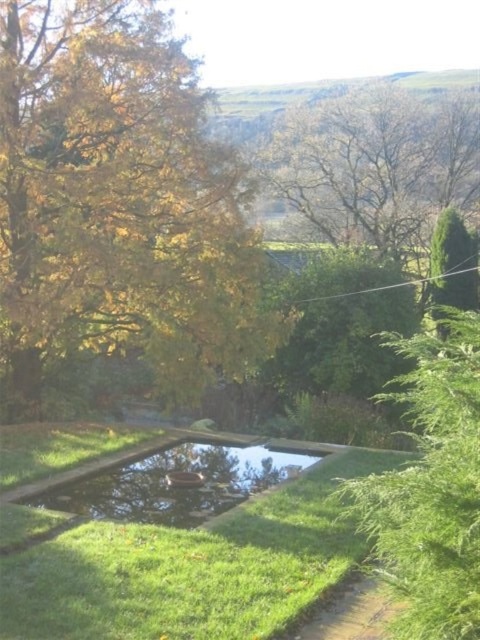
Question: Which point is farther from the camera taking this photo?

Choices:
 (A) (181, 484)
 (B) (310, 179)
 (C) (377, 563)

Answer: (B)

Question: Is yellow leafy tree at left in front of brown dirt path at lower center?

Choices:
 (A) yes
 (B) no

Answer: (B)

Question: Is green grass at center wider than green textured tree at right?

Choices:
 (A) yes
 (B) no

Answer: (A)

Question: Does golden leafy tree at upper center appear over green textured tree at right?

Choices:
 (A) yes
 (B) no

Answer: (A)

Question: Which object is positioned farthest from the green grass at center?

Choices:
 (A) green leafy tree at right
 (B) golden leafy tree at upper center
 (C) green textured tree at right

Answer: (B)

Question: Which object appears farthest from the camera in this image?

Choices:
 (A) green textured tree at right
 (B) green grass at center
 (C) green leafy tree at right
 (D) brown dirt path at lower center

Answer: (A)